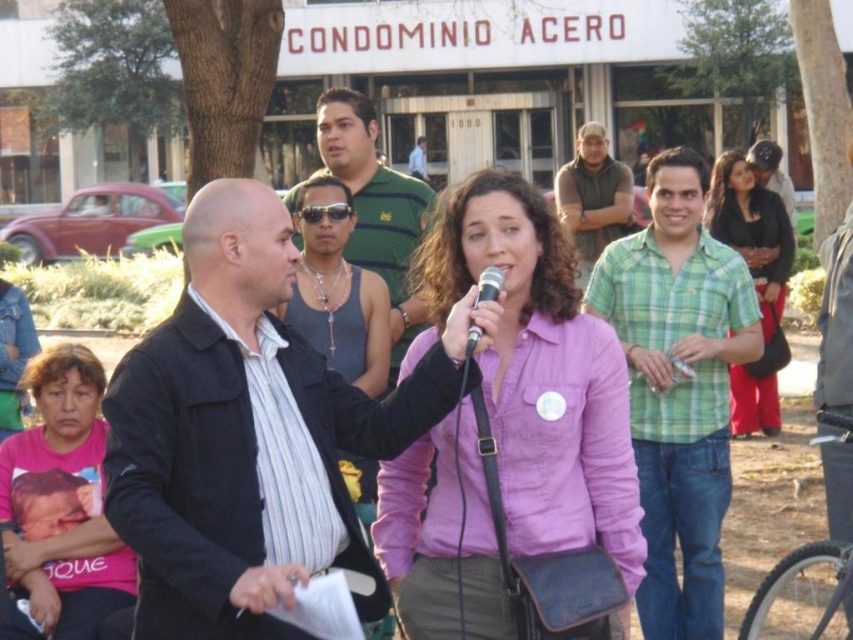
Is green striped tank top at center positioned before brown leather jacket at center?

Yes, it is in front of brown leather jacket at center.

Is green striped tank top at center wider than brown leather jacket at center?

Incorrect, green striped tank top at center's width does not surpass brown leather jacket at center's.

Is point (372, 262) less distant than point (564, 214)?

Yes, it is.

Where is `green striped tank top at center`? green striped tank top at center is located at coordinates [x=375, y=204].

Is point (73, 419) farther from viewer compared to point (602, 220)?

No, it is in front of (602, 220).

This screenshot has width=853, height=640. What do you see at coordinates (61, 502) in the screenshot?
I see `pink fabric shirt at lower left` at bounding box center [61, 502].

Locate an element on the screen. This screenshot has width=853, height=640. pink fabric shirt at lower left is located at coordinates (61, 502).

Which is below, pink cotton shirt at center or green plaid shirt at center?

Positioned lower is green plaid shirt at center.

Does pink cotton shirt at center have a greater height compared to green plaid shirt at center?

No.

Image resolution: width=853 pixels, height=640 pixels. Find the location of `pink cotton shirt at center`. pink cotton shirt at center is located at coordinates (538, 371).

In order to click on pink cotton shirt at center in this screenshot , I will do `click(538, 371)`.